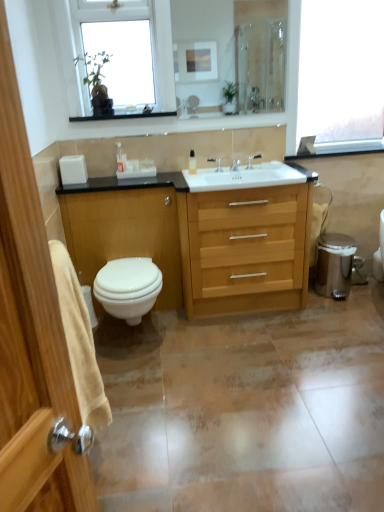
Question: Which direction should I rotate to look at white glossy lotion at center, which is the second toiletry from left to right, — up or down?

Choices:
 (A) up
 (B) down

Answer: (A)

Question: From a real-world perspective, is white glossy toilet at lower left beneath silver metallic faucet at center, the 1th tap when ordered from left to right?

Choices:
 (A) yes
 (B) no

Answer: (A)

Question: From a real-world perspective, is white glossy toilet at lower left located higher than silver metallic faucet at center, positioned as the 2th tap in right-to-left order?

Choices:
 (A) no
 (B) yes

Answer: (A)

Question: From the image's perspective, does white glossy toilet at lower left appear higher than silver metallic faucet at center, positioned as the 2th tap in right-to-left order?

Choices:
 (A) yes
 (B) no

Answer: (B)

Question: Can you confirm if white glossy toilet at lower left is taller than silver metallic faucet at center, positioned as the 2th tap in right-to-left order?

Choices:
 (A) no
 (B) yes

Answer: (B)

Question: Is white glossy toilet at lower left smaller than silver metallic faucet at center, the 1th tap when ordered from left to right?

Choices:
 (A) yes
 (B) no

Answer: (B)

Question: Can we say white glossy toilet at lower left lies outside silver metallic faucet at center, positioned as the 2th tap in right-to-left order?

Choices:
 (A) no
 (B) yes

Answer: (B)

Question: From the image's perspective, is matte silver faucet at center, the first tap positioned from the right, located above matte brown tile at center?

Choices:
 (A) no
 (B) yes

Answer: (B)

Question: Considering the relative sizes of matte silver faucet at center, the second tap in the left-to-right sequence, and matte brown tile at center in the image provided, is matte silver faucet at center, the second tap in the left-to-right sequence, bigger than matte brown tile at center?

Choices:
 (A) no
 (B) yes

Answer: (A)

Question: From the image's perspective, is matte silver faucet at center, the first tap positioned from the right, located beneath matte brown tile at center?

Choices:
 (A) yes
 (B) no

Answer: (B)

Question: Does matte silver faucet at center, the second tap in the left-to-right sequence, have a lesser width compared to matte brown tile at center?

Choices:
 (A) no
 (B) yes

Answer: (B)

Question: Does matte silver faucet at center, the second tap in the left-to-right sequence, lie in front of matte brown tile at center?

Choices:
 (A) no
 (B) yes

Answer: (A)

Question: Is matte silver faucet at center, the second tap in the left-to-right sequence, in contact with matte brown tile at center?

Choices:
 (A) yes
 (B) no

Answer: (B)

Question: Is transparent glass window at upper right, the 2th window when ordered from left to right, further to the viewer compared to white glossy toilet at lower left?

Choices:
 (A) yes
 (B) no

Answer: (A)